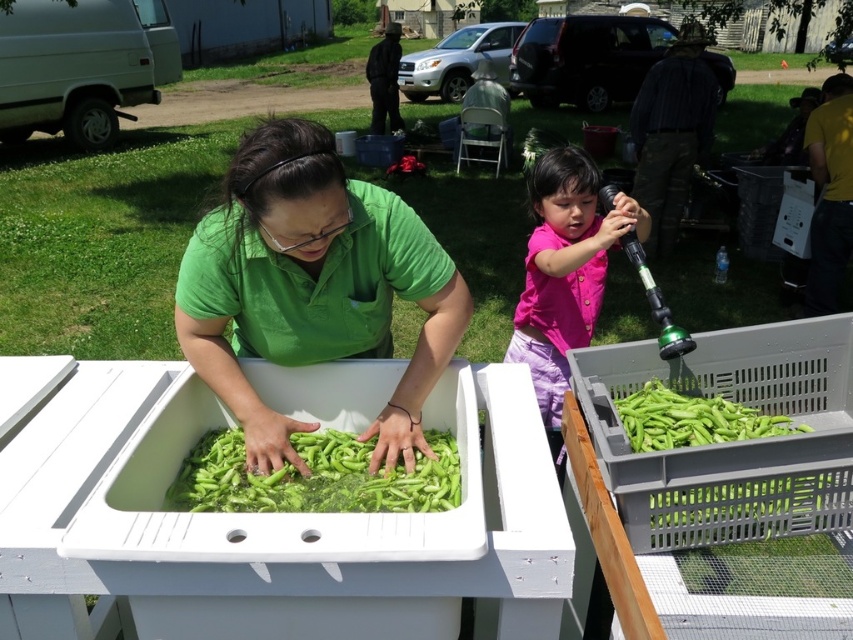
Question: Observing the image, what is the correct spatial positioning of pink matte shirt at upper right in reference to green matte pod at right?

Choices:
 (A) above
 (B) below

Answer: (A)

Question: Does pink matte shirt at upper right have a greater width compared to green matte pod at right?

Choices:
 (A) no
 (B) yes

Answer: (A)

Question: Which point is closer to the camera taking this photo?

Choices:
 (A) (526, 349)
 (B) (782, 490)
 (C) (404, 218)

Answer: (B)

Question: Can you confirm if green plastic crate at lower right is bigger than green matte pod at right?

Choices:
 (A) no
 (B) yes

Answer: (A)

Question: Which point is closer to the camera?

Choices:
 (A) green matte shirt at center
 (B) green matte pod at right
 (C) pink matte shirt at upper right
 (D) green plastic crate at lower right

Answer: (D)

Question: Among these points, which one is nearest to the camera?

Choices:
 (A) (393, 493)
 (B) (328, 227)
 (C) (759, 412)
 (D) (564, 380)

Answer: (B)